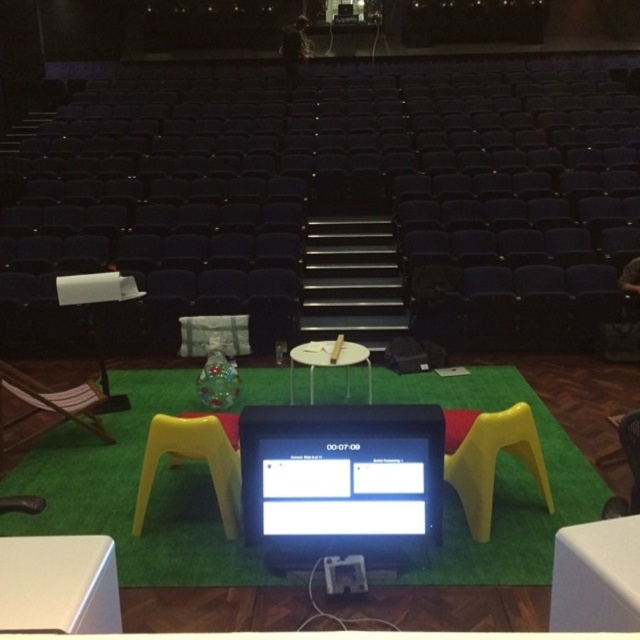
You are an actor standing on the stage and need to quickly grab your script from the white plastic table at lower left and then sit on the yellow plastic stool at lower center. Can you reach the stool without moving past the table?

The white plastic table at lower left is closer to the viewer than the yellow plastic stool at lower center, so you can reach the stool without moving past the table since the stool is farther away and within reach after grabbing the script from the table.

You are an actor standing at the back of the stage in the theater. You need to quickly retrieve an item from the stage. There are two points marked on the stage floor. One is at point (60, 572) and the other is at point (164, 422). Which point is closer to you as you stand at the back of the stage?

Point (60, 572) is in front of point (164, 422), so the point (164, 422) is closer to you at the back of the stage.

You are an event organizer setting up for a presentation. You have a large banner that needs to be placed on the stage. The banner is as big as the white glossy table at center. Will it fit on the wooden chair at lower right?

The white glossy table at center is bigger than the wooden chair at lower right, so the banner, which is as big as the table, will not fit on the wooden chair at lower right because it is smaller.